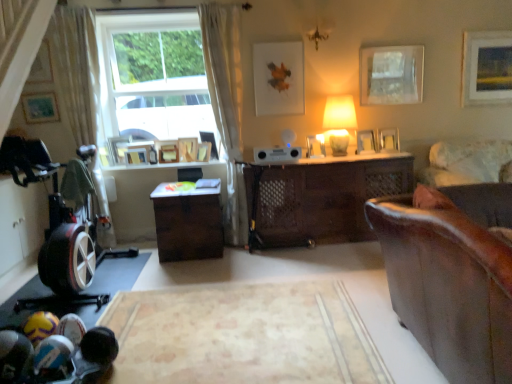
Where is `wooden picture frame at upper left, which appears as the 11th picture frame when viewed from the right`? wooden picture frame at upper left, which appears as the 11th picture frame when viewed from the right is located at coordinates (136, 155).

Identify the location of wooden picture frame at upper center, the ninth picture frame in the right-to-left sequence. The width and height of the screenshot is (512, 384). (188, 149).

This screenshot has height=384, width=512. What do you see at coordinates (188, 149) in the screenshot?
I see `wooden picture frame at upper center, the sixth picture frame positioned from the left` at bounding box center [188, 149].

The width and height of the screenshot is (512, 384). Describe the element at coordinates (451, 275) in the screenshot. I see `brown leather couch at right, marked as the first studio couch in a front-to-back arrangement` at that location.

Measure the distance between point (32, 107) and camera.

The depth of point (32, 107) is 4.16 meters.

What is the approximate width of velvet beige couch at right, arranged as the 2th studio couch when viewed from the front?

velvet beige couch at right, arranged as the 2th studio couch when viewed from the front, is 37.75 inches wide.

Locate an element on the screen. This screenshot has width=512, height=384. white sheer curtain at left, which is counted as the first curtain, starting from the left is located at coordinates (76, 69).

You are a GUI agent. You are given a task and a screenshot of the screen. Output one action in this format:
    pyautogui.click(x=<x>, y=<y>)
    Task: Click on the wooden picture frame at upper left, which appears as the 11th picture frame when viewed from the right
    The image size is (512, 384).
    Given the screenshot: What is the action you would take?
    pyautogui.click(x=136, y=155)

Which is more to the left, wooden picture frame at upper center, which is the tenth picture frame from right to left, or brown matte desk at center, the 1th desk positioned from the left?

wooden picture frame at upper center, which is the tenth picture frame from right to left.

Is wooden picture frame at upper center, acting as the fifth picture frame starting from the left, bigger or smaller than brown matte desk at center, the 1th desk positioned from the left?

In the image, wooden picture frame at upper center, acting as the fifth picture frame starting from the left, appears to be smaller than brown matte desk at center, the 1th desk positioned from the left.

Which object is closer to the camera, wooden picture frame at upper center, which is the tenth picture frame from right to left, or brown matte desk at center, placed as the 2th desk when sorted from right to left?

brown matte desk at center, placed as the 2th desk when sorted from right to left, is closer to the camera.

Is wooden picture frame at upper center, the 7th picture frame when ordered from left to right, closer to the viewer compared to wooden picture frame at upper center, which is the tenth picture frame from right to left?

Yes.

Measure the distance from wooden picture frame at upper center, the 7th picture frame when ordered from left to right, to wooden picture frame at upper center, which is the tenth picture frame from right to left.

They are 12.10 inches apart.

Is wooden picture frame at upper center, arranged as the eighth picture frame when viewed from the right, touching wooden picture frame at upper center, which is the tenth picture frame from right to left?

No, wooden picture frame at upper center, arranged as the eighth picture frame when viewed from the right, is not touching wooden picture frame at upper center, which is the tenth picture frame from right to left.

Is matte white picture frame at upper left, which appears as the 14th picture frame when viewed from the right, bigger or smaller than wooden picture frame at upper center, placed as the 7th picture frame when sorted from right to left?

Clearly, matte white picture frame at upper left, which appears as the 14th picture frame when viewed from the right, is smaller in size than wooden picture frame at upper center, placed as the 7th picture frame when sorted from right to left.

From the image's perspective, is matte white picture frame at upper left, which is the 1th picture frame in left-to-right order, positioned above or below wooden picture frame at upper center, placed as the 7th picture frame when sorted from right to left?

Based on their image positions, matte white picture frame at upper left, which is the 1th picture frame in left-to-right order, is located above wooden picture frame at upper center, placed as the 7th picture frame when sorted from right to left.

Is matte white picture frame at upper left, which is the 1th picture frame in left-to-right order, wider than wooden picture frame at upper center, which ranks as the eighth picture frame in left-to-right order?

No.

Visually, is matte white picture frame at upper left, which appears as the 14th picture frame when viewed from the right, positioned to the left or to the right of wooden picture frame at upper center, which ranks as the eighth picture frame in left-to-right order?

Clearly, matte white picture frame at upper left, which appears as the 14th picture frame when viewed from the right, is on the left of wooden picture frame at upper center, which ranks as the eighth picture frame in left-to-right order, in the image.

Does matte white picture frame at upper left, which is the 1th picture frame in left-to-right order, turn towards wooden picture frame at upper center, which is the tenth picture frame from right to left?

No.

Between point (28, 79) and point (161, 146), which one is positioned in front?

The point (28, 79) is closer to the camera.

Considering the sizes of objects matte white picture frame at upper left, which is the 1th picture frame in left-to-right order, and wooden picture frame at upper center, which is the tenth picture frame from right to left, in the image provided, who is taller, matte white picture frame at upper left, which is the 1th picture frame in left-to-right order, or wooden picture frame at upper center, which is the tenth picture frame from right to left,?

matte white picture frame at upper left, which is the 1th picture frame in left-to-right order.

Is wooden picture frame at upper center, the sixth picture frame positioned from the left, taller or shorter than matte wooden picture frame at upper left, which ranks as the 2th picture frame in left-to-right order?

In the image, wooden picture frame at upper center, the sixth picture frame positioned from the left, appears to be shorter than matte wooden picture frame at upper left, which ranks as the 2th picture frame in left-to-right order.

Does point (190, 161) appear closer or farther from the camera than point (34, 123)?

Point (190, 161) appears to be farther away from the viewer than point (34, 123).

The image size is (512, 384). Find the location of `picture frame that is the 12th object located behind the matte wooden picture frame at upper left, the 13th picture frame positioned from the right`. picture frame that is the 12th object located behind the matte wooden picture frame at upper left, the 13th picture frame positioned from the right is located at coordinates (188, 149).

From the image's perspective, is wooden picture frame at upper center, the ninth picture frame in the right-to-left sequence, below matte wooden picture frame at upper left, the 13th picture frame positioned from the right?

Correct, wooden picture frame at upper center, the ninth picture frame in the right-to-left sequence, appears lower than matte wooden picture frame at upper left, the 13th picture frame positioned from the right, in the image.

Can you confirm if wooden picture frame at upper right, which ranks as the thirteenth picture frame in left-to-right order, is wider than brown matte desk at center, placed as the 2th desk when sorted from right to left?

In fact, wooden picture frame at upper right, which ranks as the thirteenth picture frame in left-to-right order, might be narrower than brown matte desk at center, placed as the 2th desk when sorted from right to left.

From the image's perspective, is wooden picture frame at upper right, positioned as the 2th picture frame in right-to-left order, on brown matte desk at center, the 1th desk positioned from the left?

Yes, from the image's perspective, wooden picture frame at upper right, positioned as the 2th picture frame in right-to-left order, is above brown matte desk at center, the 1th desk positioned from the left.

From a real-world perspective, relative to brown matte desk at center, placed as the 2th desk when sorted from right to left, is wooden picture frame at upper right, positioned as the 2th picture frame in right-to-left order, vertically above or below?

Clearly, from a real-world perspective, wooden picture frame at upper right, positioned as the 2th picture frame in right-to-left order, is above brown matte desk at center, placed as the 2th desk when sorted from right to left.

Who is taller, wooden picture frame at upper right, positioned as the 2th picture frame in right-to-left order, or brown matte desk at center, the 1th desk positioned from the left?

With more height is brown matte desk at center, the 1th desk positioned from the left.

Which is more to the right, wooden picture frame at upper center, which ranks as the eighth picture frame in left-to-right order, or white sheer curtain at left, which is the second curtain from right to left?

Positioned to the right is wooden picture frame at upper center, which ranks as the eighth picture frame in left-to-right order.

Is wooden picture frame at upper center, placed as the 7th picture frame when sorted from right to left, in front of or behind white sheer curtain at left, which is the second curtain from right to left, in the image?

In the image, wooden picture frame at upper center, placed as the 7th picture frame when sorted from right to left, appears behind white sheer curtain at left, which is the second curtain from right to left.

Are wooden picture frame at upper center, placed as the 7th picture frame when sorted from right to left, and white sheer curtain at left, which is the second curtain from right to left, far apart?

That's right, there is a large distance between wooden picture frame at upper center, placed as the 7th picture frame when sorted from right to left, and white sheer curtain at left, which is the second curtain from right to left.

Considering the relative sizes of wooden picture frame at upper center, which ranks as the eighth picture frame in left-to-right order, and white sheer curtain at left, which is the second curtain from right to left, in the image provided, is wooden picture frame at upper center, which ranks as the eighth picture frame in left-to-right order, shorter than white sheer curtain at left, which is the second curtain from right to left,?

Indeed, wooden picture frame at upper center, which ranks as the eighth picture frame in left-to-right order, has a lesser height compared to white sheer curtain at left, which is the second curtain from right to left.

At what (x,y) coordinates should I click in order to perform the action: click on the 2nd desk below the wooden picture frame at upper center, which is the tenth picture frame from right to left (from the image's perspective). Please return your answer as a coordinate pair (x, y). This screenshot has width=512, height=384. Looking at the image, I should click on (188, 222).

The width and height of the screenshot is (512, 384). What are the coordinates of `the 3rd picture frame behind the wooden picture frame at upper center, the 7th picture frame when ordered from left to right` in the screenshot? It's located at (167, 151).

Considering their positions, is velvet beige couch at right, arranged as the 2th studio couch when viewed from the front, positioned closer to wooden picture frame at center, the 10th picture frame viewed from the left, than matte white picture frame at upper center, arranged as the ninth picture frame when viewed from the left?

Among the two, matte white picture frame at upper center, arranged as the ninth picture frame when viewed from the left, is located nearer to wooden picture frame at center, the 10th picture frame viewed from the left.

From the image, which object appears to be farther from wooden picture frame at upper center, which is the tenth picture frame from right to left, velvet beige couch at right, arranged as the 2th studio couch when viewed from the front, or brown matte desk at center, the 1th desk positioned from the left?

velvet beige couch at right, arranged as the 2th studio couch when viewed from the front, is further to wooden picture frame at upper center, which is the tenth picture frame from right to left.

Which object lies nearer to the anchor point wooden picture frame at center, the 12th picture frame when ordered from left to right, brown matte desk at center, placed as the 2th desk when sorted from right to left, or wooden picture frame at upper center, the sixth picture frame positioned from the left?

Among the two, wooden picture frame at upper center, the sixth picture frame positioned from the left, is located nearer to wooden picture frame at center, the 12th picture frame when ordered from left to right.

Based on the photo, which object lies nearer to the anchor point wooden picture frame at upper center, placed as the 7th picture frame when sorted from right to left, white sheer curtain at center, which appears as the second curtain when viewed from the left, or wooden picture frame at window, which is the 12th picture frame in right-to-left order?

white sheer curtain at center, which appears as the second curtain when viewed from the left.

Which object lies nearer to the anchor point velvet beige couch at right, the 1th studio couch in the back-to-front sequence, brown leather couch at right, marked as the 2th studio couch in a back-to-front arrangement, or wooden picture frame at center, the 10th picture frame viewed from the left?

wooden picture frame at center, the 10th picture frame viewed from the left, is closer to velvet beige couch at right, the 1th studio couch in the back-to-front sequence.

Looking at the image, which one is located further to wooden picture frame at upper center, the sixth picture frame positioned from the left, wooden picture frame at upper right, which ranks as the thirteenth picture frame in left-to-right order, or white sheer curtain at left, which is counted as the first curtain, starting from the left?

wooden picture frame at upper right, which ranks as the thirteenth picture frame in left-to-right order, is further to wooden picture frame at upper center, the sixth picture frame positioned from the left.

From the image, which object appears to be nearer to beige carpet at center, wooden picture frame at upper left, which appears as the 11th picture frame when viewed from the right, or wooden picture frame at upper center, the 7th picture frame when ordered from left to right?

wooden picture frame at upper center, the 7th picture frame when ordered from left to right.

Considering their positions, is matte white picture frame at upper left, which appears as the 14th picture frame when viewed from the right, positioned further to wooden picture frame at center, acting as the fifth picture frame starting from the right, than wooden picture frame at center, placed as the third picture frame when sorted from right to left?

Based on the image, matte white picture frame at upper left, which appears as the 14th picture frame when viewed from the right, appears to be further to wooden picture frame at center, acting as the fifth picture frame starting from the right.

Find the location of `lamp between wooden picture frame at window, acting as the third picture frame starting from the left, and wooden picture frame at center, the fourth picture frame viewed from the right, in the horizontal direction`. lamp between wooden picture frame at window, acting as the third picture frame starting from the left, and wooden picture frame at center, the fourth picture frame viewed from the right, in the horizontal direction is located at coordinates (339, 122).

Find the location of `desk situated between matte wooden picture frame at upper left, the 13th picture frame positioned from the right, and wooden picture frame at center, the 10th picture frame viewed from the left, from left to right`. desk situated between matte wooden picture frame at upper left, the 13th picture frame positioned from the right, and wooden picture frame at center, the 10th picture frame viewed from the left, from left to right is located at coordinates (188, 222).

The height and width of the screenshot is (384, 512). What are the coordinates of `lamp between wooden picture frame at upper left, which appears as the 11th picture frame when viewed from the right, and wooden picture frame at center, the eleventh picture frame viewed from the left, from left to right` in the screenshot? It's located at (339, 122).

The height and width of the screenshot is (384, 512). In order to click on plain situated between matte white picture frame at upper left, which is the 1th picture frame in left-to-right order, and wooden picture frame at center, acting as the fifth picture frame starting from the right, from left to right in this screenshot , I will do `click(243, 335)`.